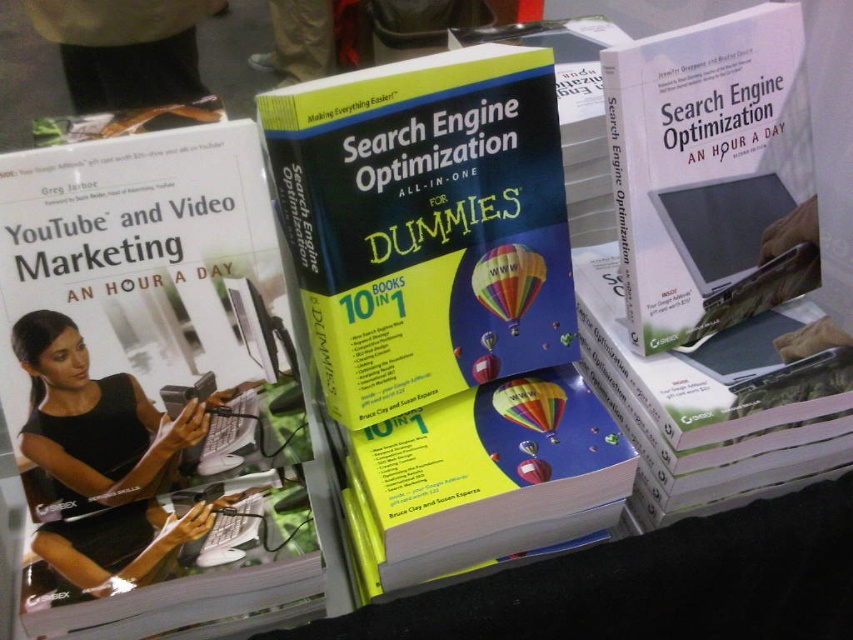
Question: Does yellow paperback book at center come behind white paper book at center?

Choices:
 (A) no
 (B) yes

Answer: (A)

Question: Does yellow paperback book at center appear over black matte laptop at lower left?

Choices:
 (A) yes
 (B) no

Answer: (A)

Question: Which of the following is the closest to the observer?

Choices:
 (A) (660, 305)
 (B) (102, 564)
 (C) (352, 472)
 (D) (415, 116)

Answer: (B)

Question: Which point is closer to the camera?

Choices:
 (A) yellow paperback book at center
 (B) yellow matte book at center
 (C) multicolored fabric balloon at center
 (D) black matte laptop at lower left

Answer: (A)

Question: Which object appears closest to the camera in this image?

Choices:
 (A) yellow paperback book at center
 (B) yellow matte book at center

Answer: (A)

Question: From the image, what is the correct spatial relationship of yellow matte book at center in relation to black matte laptop at lower left?

Choices:
 (A) right
 (B) left

Answer: (A)